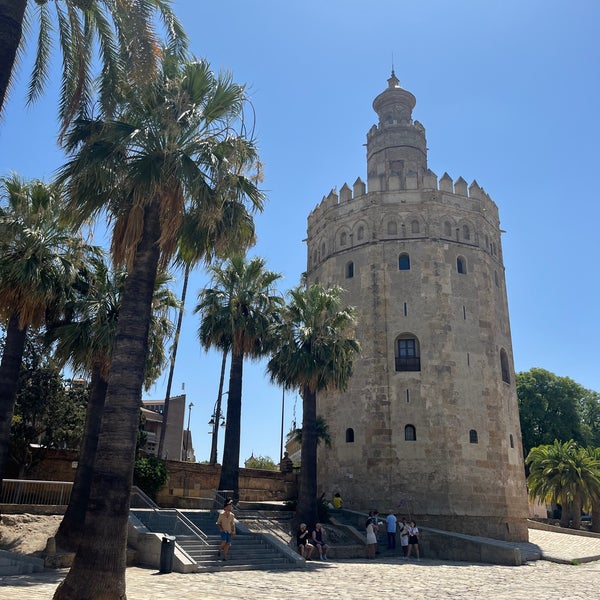
The width and height of the screenshot is (600, 600). Find the location of `stairs`. stairs is located at coordinates (262, 550), (208, 518).